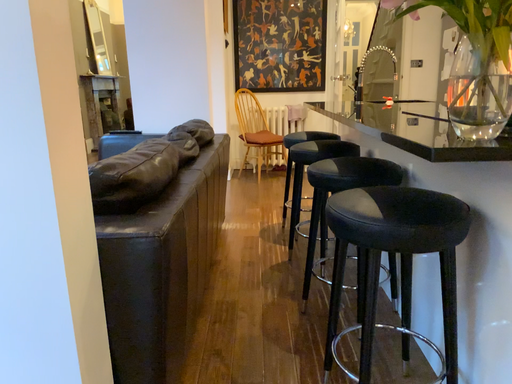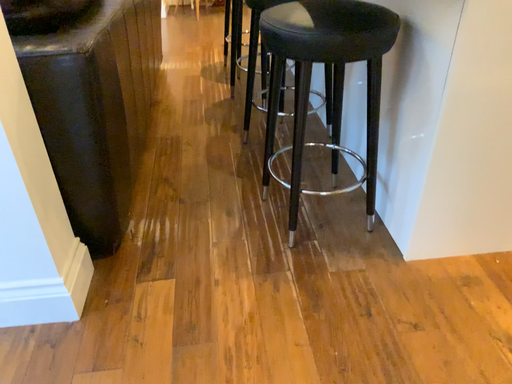
Question: Which way did the camera rotate in the video?

Choices:
 (A) rotated left
 (B) rotated right

Answer: (B)